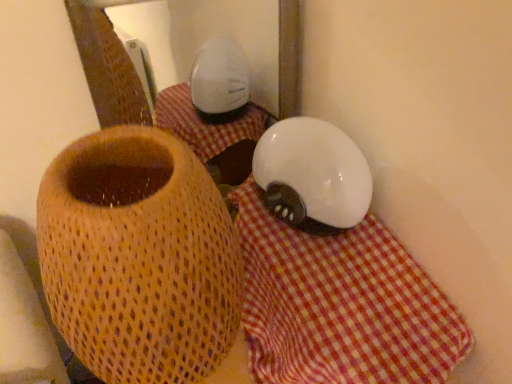
Find the location of a particular element. The width and height of the screenshot is (512, 384). white checkered cloth at center is located at coordinates (341, 305).

Describe the element at coordinates (341, 305) in the screenshot. I see `white checkered cloth at center` at that location.

In the scene shown: What is the approximate width of white checkered cloth at center?

→ The width of white checkered cloth at center is 16.21 inches.

The height and width of the screenshot is (384, 512). What do you see at coordinates (140, 263) in the screenshot? I see `matte woven vase at center` at bounding box center [140, 263].

I want to click on matte woven vase at center, so click(140, 263).

Image resolution: width=512 pixels, height=384 pixels. What are the coordinates of `white checkered cloth at center` in the screenshot? It's located at [x=341, y=305].

Between white checkered cloth at center and matte woven vase at center, which one appears on the right side from the viewer's perspective?

white checkered cloth at center is more to the right.

Does white checkered cloth at center lie in front of matte woven vase at center?

No, white checkered cloth at center is further to the viewer.

Which point is more forward, (396, 373) or (169, 318)?

The point (169, 318) is more forward.

From the image's perspective, does white checkered cloth at center appear lower than matte woven vase at center?

Yes.

From a real-world perspective, which is physically above, white checkered cloth at center or matte woven vase at center?

matte woven vase at center.

Consider the image. Considering the sizes of white checkered cloth at center and matte woven vase at center in the image, is white checkered cloth at center wider or thinner than matte woven vase at center?

In the image, white checkered cloth at center appears to be wider than matte woven vase at center.

Between white checkered cloth at center and matte woven vase at center, which one has more height?

matte woven vase at center.

Considering the sizes of objects white checkered cloth at center and matte woven vase at center in the image provided, who is bigger, white checkered cloth at center or matte woven vase at center?

matte woven vase at center.

Is white checkered cloth at center not inside matte woven vase at center?

Yes, white checkered cloth at center is not within matte woven vase at center.

Is the surface of white checkered cloth at center in direct contact with matte woven vase at center?

Result: There is a gap between white checkered cloth at center and matte woven vase at center.

Could you tell me if white checkered cloth at center is turned towards matte woven vase at center?

No, white checkered cloth at center is not aimed at matte woven vase at center.

How many degrees apart are the facing directions of white checkered cloth at center and matte woven vase at center?

They differ by 0.000518 degrees in their facing directions.

How much distance is there between white checkered cloth at center and matte woven vase at center?

white checkered cloth at center is 18.30 centimeters away from matte woven vase at center.

The width and height of the screenshot is (512, 384). I want to click on vase that appears on the left of white checkered cloth at center, so [x=140, y=263].

Which is more to the left, matte woven vase at center or white checkered cloth at center?

matte woven vase at center.

Which object is further away from the camera taking this photo, matte woven vase at center or white checkered cloth at center?

white checkered cloth at center is more distant.

Is point (154, 287) positioned behind point (426, 293)?

No, it is not.

From the image's perspective, which object appears higher, matte woven vase at center or white checkered cloth at center?

matte woven vase at center.

From a real-world perspective, which object rests below the other?

white checkered cloth at center is physically lower.

Is matte woven vase at center thinner than white checkered cloth at center?

Yes, matte woven vase at center is thinner than white checkered cloth at center.

Can you confirm if matte woven vase at center is taller than white checkered cloth at center?

Yes, matte woven vase at center is taller than white checkered cloth at center.

Who is bigger, matte woven vase at center or white checkered cloth at center?

matte woven vase at center is bigger.

Is matte woven vase at center inside the boundaries of white checkered cloth at center, or outside?

matte woven vase at center is located beyond the bounds of white checkered cloth at center.

Is matte woven vase at center next to white checkered cloth at center and touching it?

No, matte woven vase at center is not with white checkered cloth at center.

From the picture: Is matte woven vase at center looking in the opposite direction of white checkered cloth at center?

matte woven vase at center is not turned away from white checkered cloth at center.

How distant is matte woven vase at center from white checkered cloth at center?

They are 7.21 inches apart.

This screenshot has width=512, height=384. Identify the location of vase to the left of white checkered cloth at center. (x=140, y=263).

The height and width of the screenshot is (384, 512). In order to click on vase that is above the white checkered cloth at center (from the image's perspective) in this screenshot , I will do `click(140, 263)`.

Where is `vase that appears on the left of white checkered cloth at center`? This screenshot has width=512, height=384. vase that appears on the left of white checkered cloth at center is located at coordinates (140, 263).